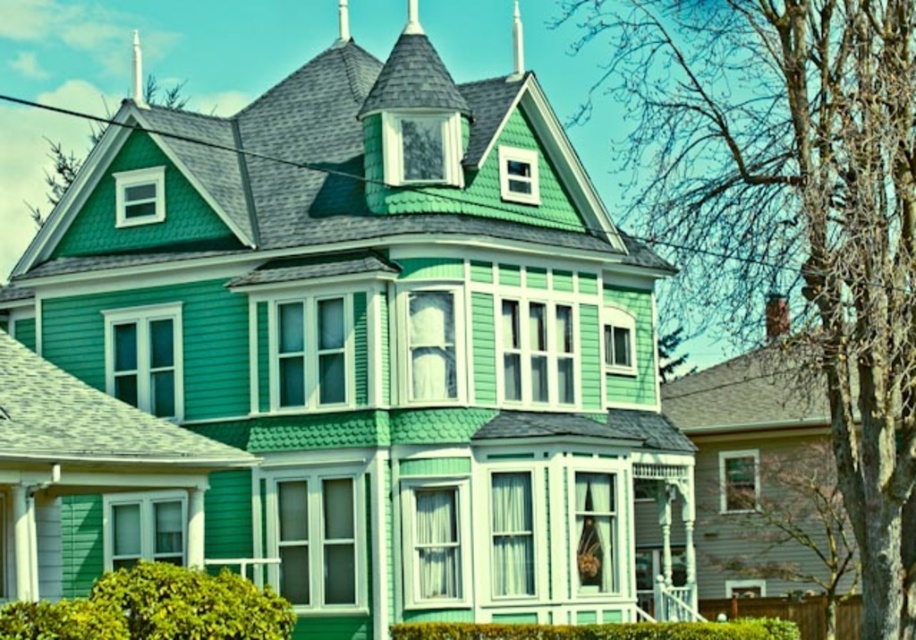
You are a window washer standing on the roof of the house. You need to clean both the smooth white spire at upper center and the metallic spire at upper center. Which spire will require less ladder height to reach the top?

The smooth white spire at upper center has a smaller size compared to metallic spire at upper center, so it will require less ladder height to reach the top.

You are a window washer standing on the roof of the house. You need to clean both the smooth white spire at upper center and the metallic spire at upper center. Which spire will require you to climb higher to reach its top?

The smooth white spire at upper center requires climbing higher to reach its top since it has a greater height compared to the metallic spire at upper center.

You are standing at the base of the house and want to place a decorative flag between the smooth white spire at upper center and the metallic spire at upper center. The flag requires 2 meters of space between its poles. Can you fit the flag there?

The smooth white spire at upper center and the metallic spire at upper center are 13.31 meters apart. Since the flag needs only 2 meters of space, there is sufficient room to place the flag between them.